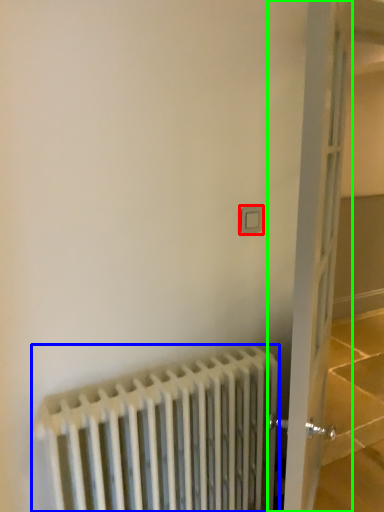
Question: Which object is positioned farthest from electric outlet (highlighted by a red box)? Select from radiator (highlighted by a blue box) and door (highlighted by a green box).

Choices:
 (A) radiator
 (B) door

Answer: (A)